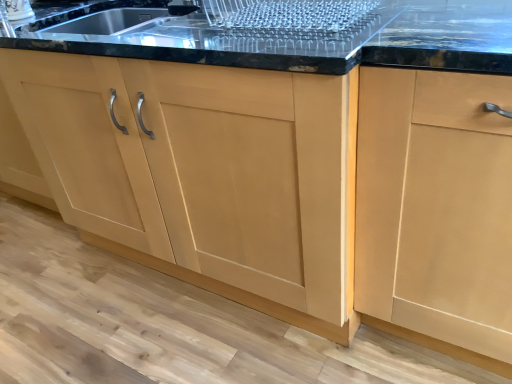
Question: Considering the relative positions of matte wood cabinet at right, which is the first cabinetry from right to left, and light wood cabinet at center, which appears as the second cabinetry when viewed from the right, in the image provided, is matte wood cabinet at right, which is the first cabinetry from right to left, in front of light wood cabinet at center, which appears as the second cabinetry when viewed from the right,?

Choices:
 (A) no
 (B) yes

Answer: (B)

Question: Does matte wood cabinet at right, which is the first cabinetry from right to left, have a lesser width compared to light wood cabinet at center, which appears as the second cabinetry when viewed from the right?

Choices:
 (A) no
 (B) yes

Answer: (B)

Question: Could you tell me if matte wood cabinet at right, which ranks as the 2th cabinetry in left-to-right order, is turned towards light wood cabinet at center, which appears as the second cabinetry when viewed from the right?

Choices:
 (A) yes
 (B) no

Answer: (B)

Question: Is matte wood cabinet at right, which ranks as the 2th cabinetry in left-to-right order, further to the viewer compared to light wood cabinet at center, acting as the 1th cabinetry starting from the left?

Choices:
 (A) no
 (B) yes

Answer: (A)

Question: Is matte wood cabinet at right, which is the first cabinetry from right to left, in contact with light wood cabinet at center, which appears as the second cabinetry when viewed from the right?

Choices:
 (A) no
 (B) yes

Answer: (A)

Question: Does matte wood cabinet at right, which is the first cabinetry from right to left, have a larger size compared to light wood cabinet at center, acting as the 1th cabinetry starting from the left?

Choices:
 (A) no
 (B) yes

Answer: (A)

Question: Can you confirm if light wood cabinet at center, which appears as the second cabinetry when viewed from the right, is thinner than matte wood cabinet at right, which ranks as the 2th cabinetry in left-to-right order?

Choices:
 (A) no
 (B) yes

Answer: (A)

Question: Does light wood cabinet at center, which appears as the second cabinetry when viewed from the right, have a lesser height compared to matte wood cabinet at right, which is the first cabinetry from right to left?

Choices:
 (A) no
 (B) yes

Answer: (B)

Question: Is light wood cabinet at center, acting as the 1th cabinetry starting from the left, next to matte wood cabinet at right, which is the first cabinetry from right to left, and touching it?

Choices:
 (A) no
 (B) yes

Answer: (A)

Question: Is light wood cabinet at center, which appears as the second cabinetry when viewed from the right, positioned far away from matte wood cabinet at right, which is the first cabinetry from right to left?

Choices:
 (A) yes
 (B) no

Answer: (B)

Question: Does light wood cabinet at center, which appears as the second cabinetry when viewed from the right, turn towards matte wood cabinet at right, which ranks as the 2th cabinetry in left-to-right order?

Choices:
 (A) no
 (B) yes

Answer: (A)

Question: Is light wood cabinet at center, acting as the 1th cabinetry starting from the left, taller than matte wood cabinet at right, which ranks as the 2th cabinetry in left-to-right order?

Choices:
 (A) no
 (B) yes

Answer: (A)

Question: Is matte wood cabinet at right, which is the first cabinetry from right to left, situated inside light wood cabinet at center, which appears as the second cabinetry when viewed from the right, or outside?

Choices:
 (A) inside
 (B) outside

Answer: (B)